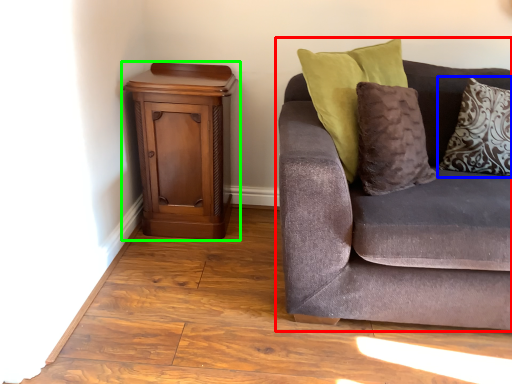
Question: Considering the real-world distances, which object is farthest from studio couch (highlighted by a red box)? pillow (highlighted by a blue box) or nightstand (highlighted by a green box)?

Choices:
 (A) pillow
 (B) nightstand

Answer: (B)